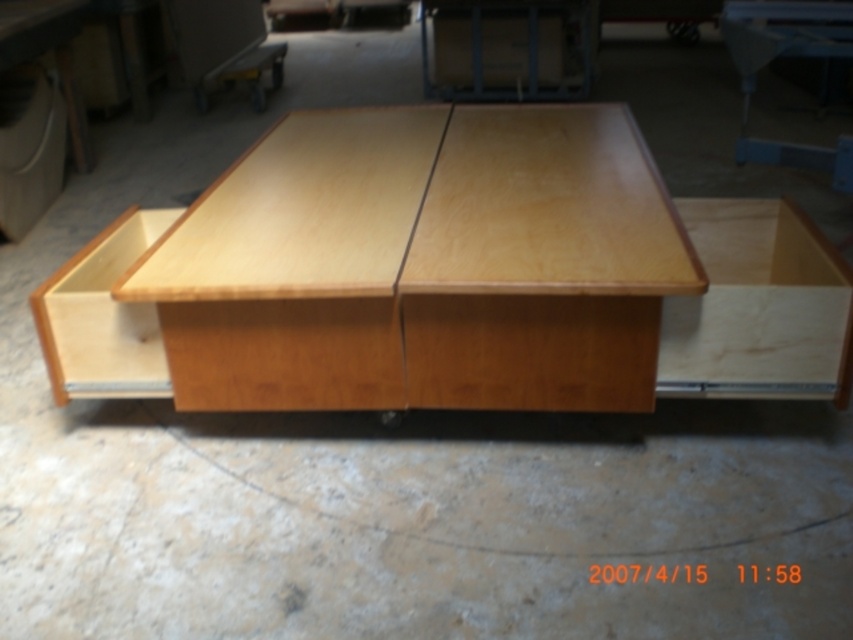
Question: Is light wood table at center wider than light wood drawer at lower left?

Choices:
 (A) no
 (B) yes

Answer: (B)

Question: Is light wood table at center thinner than light wood drawer at lower left?

Choices:
 (A) yes
 (B) no

Answer: (B)

Question: Can you confirm if light wood table at center is positioned to the left of light wood drawer at lower left?

Choices:
 (A) yes
 (B) no

Answer: (B)